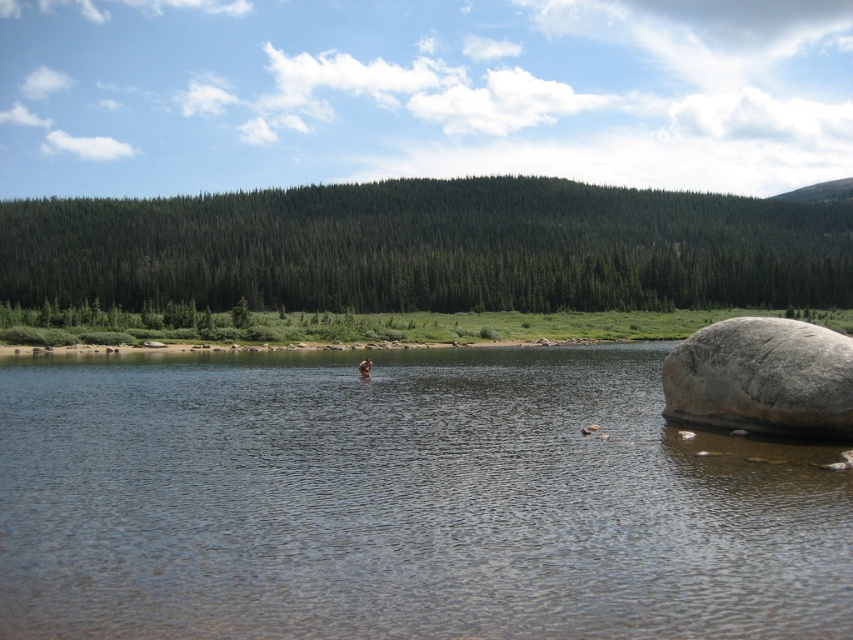
Does clear water at center appear under gray granite boulder at right?

Yes, clear water at center is below gray granite boulder at right.

Does clear water at center have a greater width compared to gray granite boulder at right?

Yes, clear water at center is wider than gray granite boulder at right.

At what (x,y) coordinates should I click in order to perform the action: click on clear water at center. Please return your answer as a coordinate pair (x, y). The width and height of the screenshot is (853, 640). Looking at the image, I should click on tap(402, 500).

Locate an element on the screen. clear water at center is located at coordinates (402, 500).

Which is above, gray granite boulder at right or smooth skin person at center?

gray granite boulder at right is higher up.

This screenshot has height=640, width=853. In order to click on gray granite boulder at right in this screenshot , I will do `click(762, 378)`.

Which is behind, point (848, 513) or point (364, 358)?

The point (364, 358) is behind.

Does clear water at center appear over smooth skin person at center?

Incorrect, clear water at center is not positioned above smooth skin person at center.

What do you see at coordinates (402, 500) in the screenshot?
I see `clear water at center` at bounding box center [402, 500].

Find the location of a particular element. Image resolution: width=853 pixels, height=640 pixels. clear water at center is located at coordinates (402, 500).